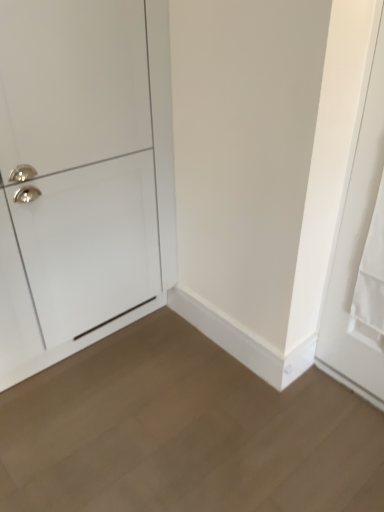
Identify the location of blank space situated above light brown wood floor at lower center (from a real-world perspective). The width and height of the screenshot is (384, 512). (181, 419).